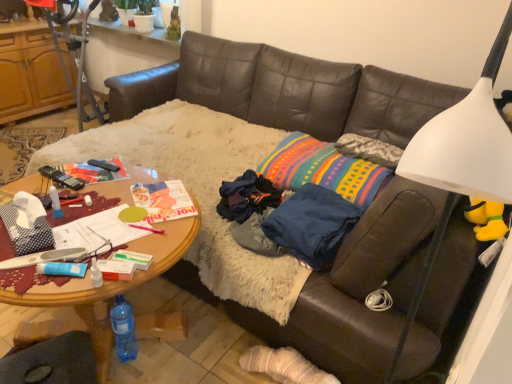
Where is `vacant space that is to the left of black plastic remote control at center`? This screenshot has height=384, width=512. vacant space that is to the left of black plastic remote control at center is located at coordinates (72, 170).